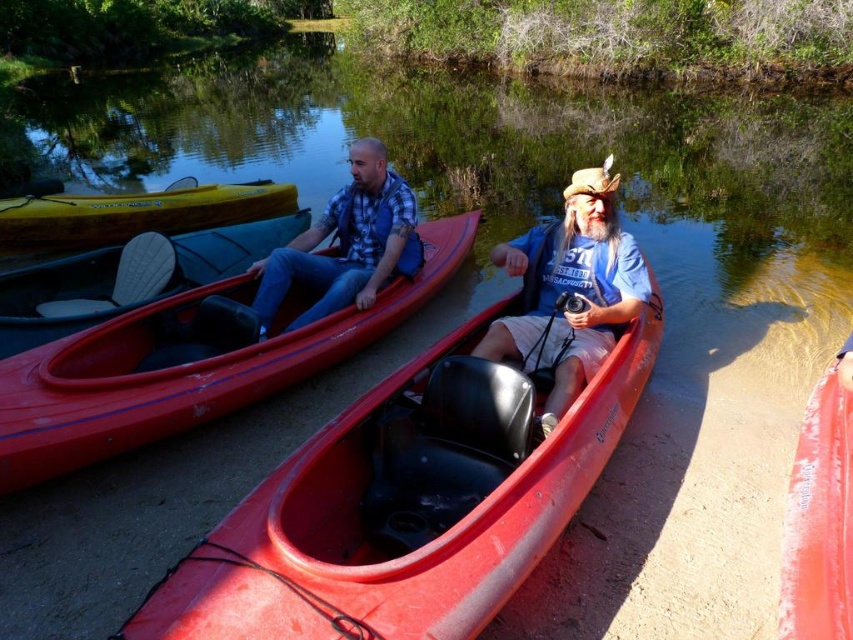
Can you confirm if rubberized red canoe at center is taller than rubberized red canoe at lower right?

Indeed, rubberized red canoe at center has a greater height compared to rubberized red canoe at lower right.

How distant is rubberized red canoe at center from rubberized red canoe at lower right?

rubberized red canoe at center is 1.43 meters away from rubberized red canoe at lower right.

Between point (640, 330) and point (827, 634), which one is positioned behind?

Positioned behind is point (640, 330).

At what (x,y) coordinates should I click in order to perform the action: click on rubberized red canoe at center. Please return your answer as a coordinate pair (x, y). Looking at the image, I should click on (405, 504).

Is point (103, 285) closer to viewer compared to point (10, 240)?

Yes, it is in front of point (10, 240).

Is point (308, 220) positioned after point (111, 200)?

No, it is not.

Where is `matte black seat at left`? The height and width of the screenshot is (640, 853). matte black seat at left is located at coordinates (126, 276).

Identify the location of blue cotton shirt at center. click(x=570, y=291).

Which is below, blue cotton shirt at center or rubberized red canoe at lower right?

rubberized red canoe at lower right is lower down.

Is point (515, 342) more distant than point (836, 365)?

Yes, it is.

Image resolution: width=853 pixels, height=640 pixels. In order to click on blue cotton shirt at center in this screenshot , I will do `click(570, 291)`.